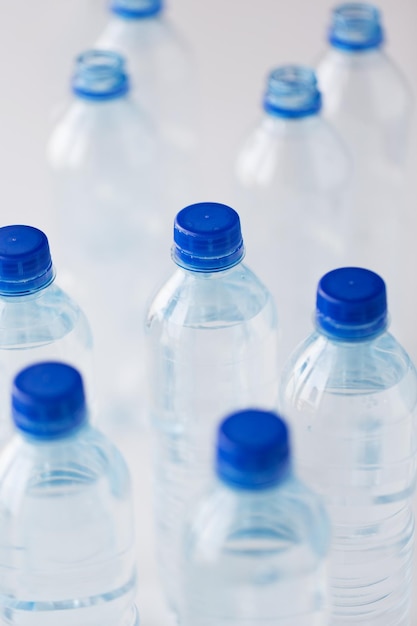
Find the location of `bottle with cap`. bottle with cap is located at coordinates (39, 498), (53, 326), (195, 320), (237, 526), (356, 385).